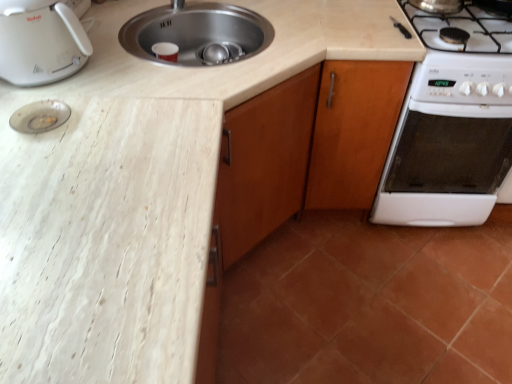
Identify the location of vacant area on top of terracotta tile at lower right (from a real-world perspective). (374, 286).